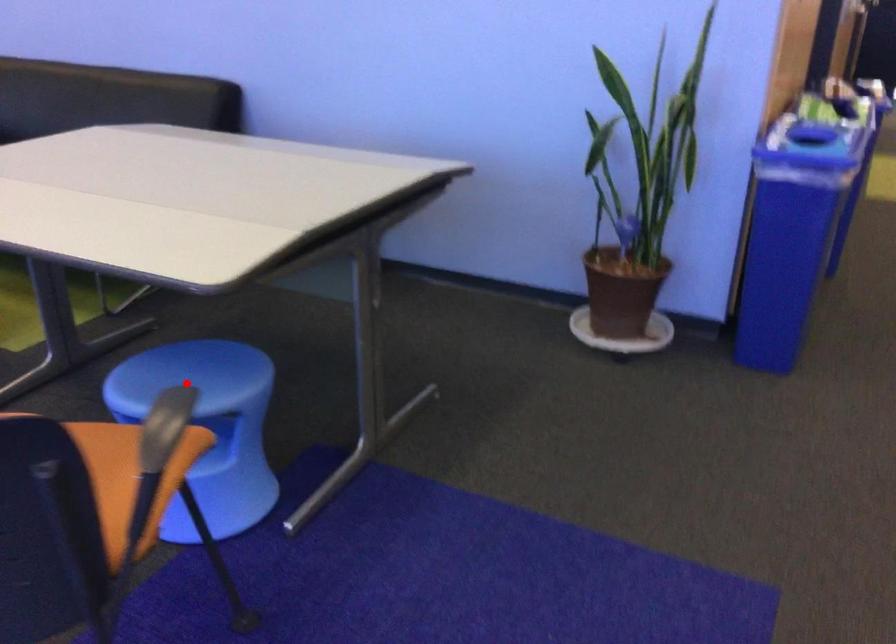
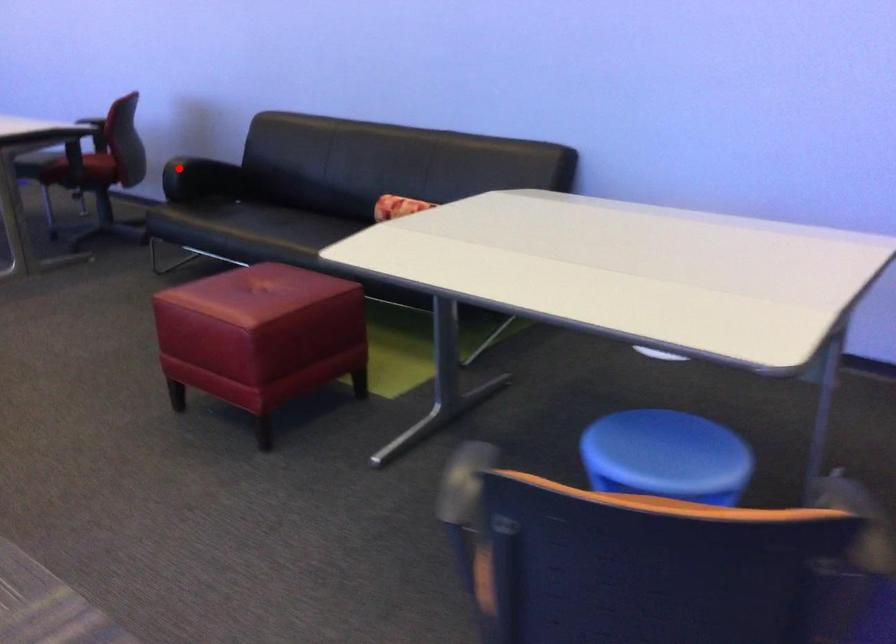
I am providing you with two images of the same scene from different viewpoints. A red point is marked on the first image and another point is marked on the second image. Is the marked point in image1 the same physical position as the marked point in image2?

No